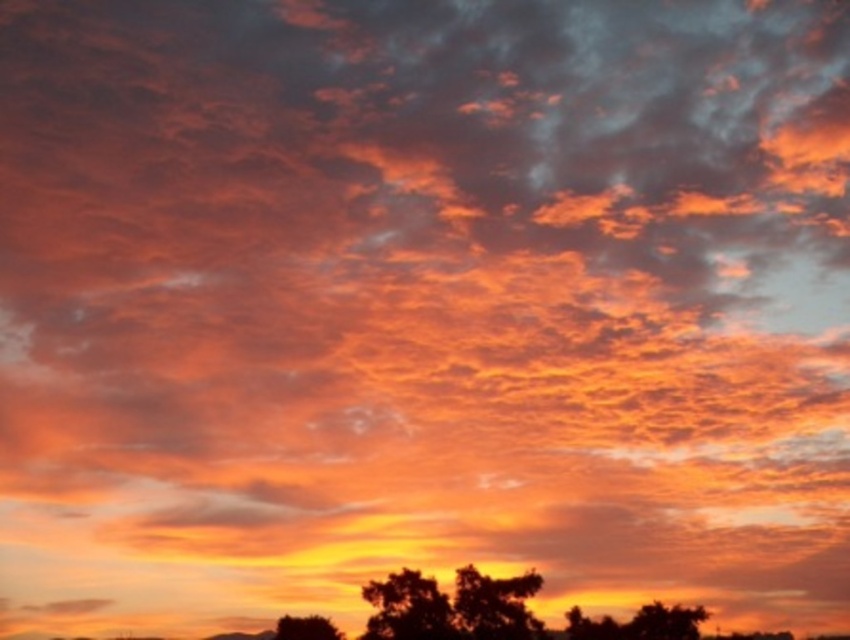
You are standing at the center of the image and want to walk towards the silhouette tree at lower center. In which direction should you move?

The silhouette tree at lower center is located at point 0.950 on the x axis and 0.533 on the y axis. Since you are at the center, which is at point 0.5 on both axes, you should move to the right along the x axis to reach the silhouette tree at lower center.

You are standing at the origin point of the coordinate system. You want to take a photo of the green leafy tree at lower right. In which direction should you move to get closer to it?

The green leafy tree at lower right is located at coordinate point (664, 621). Since you are at the origin, you should move towards the positive x and positive y directions to reach it.

You are an artist trying to paint the sunset scene. You notice two trees at the lower center of the image. Which tree is taller, the silhouetted leafy tree at lower center or the black matte tree at lower center?

The black matte tree at lower center is taller than the silhouetted leafy tree at lower center.